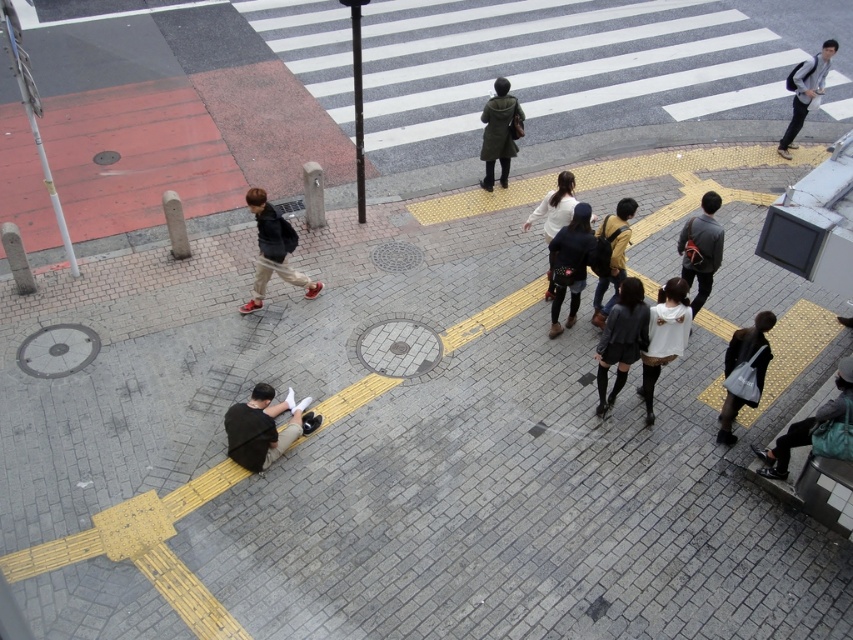
You are a pedestrian standing at the crosswalk on the yellow tactile paving. You notice two people wearing dark gray clothing. One is wearing dark gray pants at lower left and the other has a dark gray sweater at center. Which person is closer to you?

The dark gray pants at lower left is shorter than the dark gray sweater at center, so the person wearing the dark gray pants at lower left is closer to you.

You are a delivery person trying to navigate through the street. There is a pedestrian with dark gray pants at lower left and another with dark gray sweater at center. Which object is wider?

The dark gray pants at lower left might be wider than dark gray sweater at center according to the description.